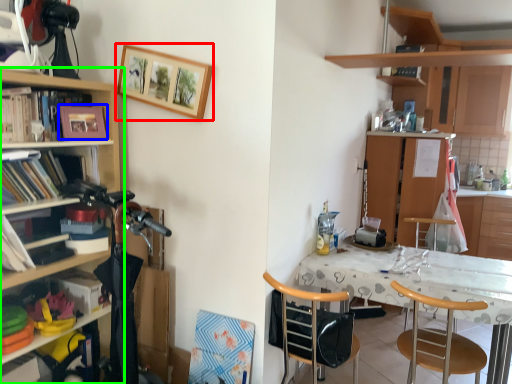
Question: Which is farther away from picture frame (highlighted by a red box)? picture frame (highlighted by a blue box) or cupboard (highlighted by a green box)?

Choices:
 (A) picture frame
 (B) cupboard

Answer: (A)